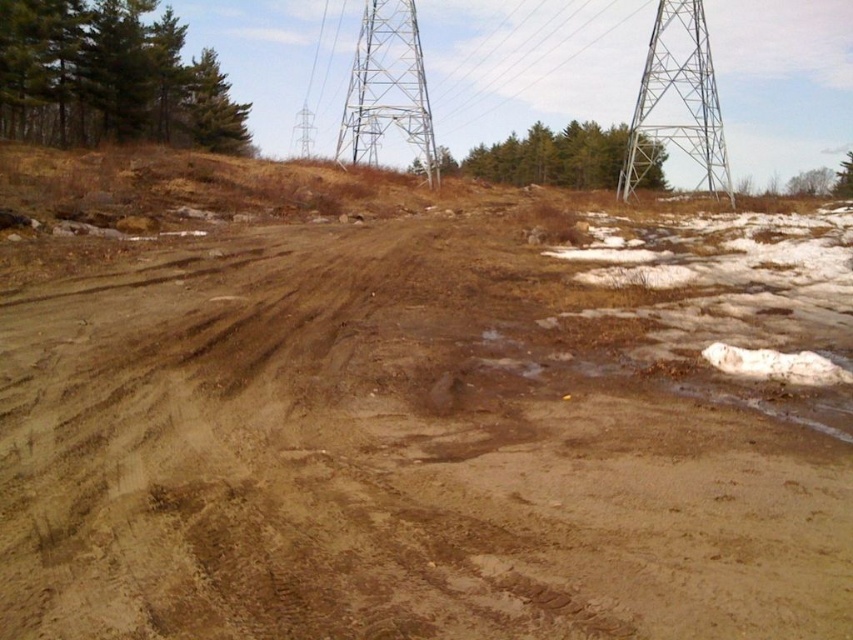
Question: Which object appears closest to the camera in this image?

Choices:
 (A) metallic silver tower at upper right
 (B) brown dirt field at center
 (C) metallic silver tower at upper center

Answer: (B)

Question: Is brown dirt field at center behind metallic silver tower at upper center?

Choices:
 (A) yes
 (B) no

Answer: (B)

Question: Is brown dirt field at center to the right of metallic silver power line at upper center from the viewer's perspective?

Choices:
 (A) no
 (B) yes

Answer: (A)

Question: Which point appears closest to the camera in this image?

Choices:
 (A) (363, 612)
 (B) (537, 32)
 (C) (666, 122)

Answer: (A)

Question: Among these points, which one is farthest from the camera?

Choices:
 (A) (405, 118)
 (B) (525, 36)
 (C) (660, 10)
 (D) (485, 342)

Answer: (B)

Question: Does brown dirt field at center appear on the left side of metallic silver power line at upper center?

Choices:
 (A) no
 (B) yes

Answer: (B)